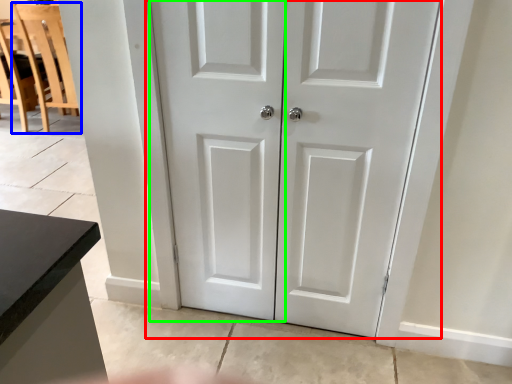
Question: Which object is positioned closest to door (highlighted by a red box)? Select from chair (highlighted by a blue box) and screen door (highlighted by a green box).

Choices:
 (A) chair
 (B) screen door

Answer: (B)